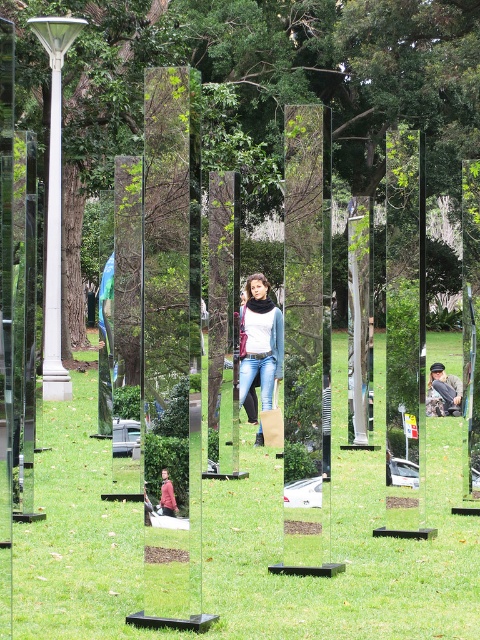
Does matte black scarf at center have a lesser width compared to camouflage fabric jacket at center?

No.

Which is more to the right, matte black scarf at center or camouflage fabric jacket at center?

camouflage fabric jacket at center is more to the right.

What do you see at coordinates (260, 340) in the screenshot? I see `matte black scarf at center` at bounding box center [260, 340].

Where is `matte black scarf at center`? This screenshot has width=480, height=640. matte black scarf at center is located at coordinates (260, 340).

Is green grass at center positioned at the back of red fabric jacket at center?

No, green grass at center is closer to the viewer.

Can you confirm if green grass at center is thinner than red fabric jacket at center?

In fact, green grass at center might be wider than red fabric jacket at center.

Does point (393, 621) lie behind point (168, 496)?

That is True.

The width and height of the screenshot is (480, 640). In order to click on green grass at center in this screenshot , I will do click(343, 548).

Does point (335, 8) come behind point (437, 365)?

Yes, it is.

Can you confirm if green leafy tree at center is smaller than camouflage fabric jacket at center?

No.

Image resolution: width=480 pixels, height=640 pixels. What do you see at coordinates (255, 80) in the screenshot?
I see `green leafy tree at center` at bounding box center [255, 80].

Where is `green leafy tree at center`? Image resolution: width=480 pixels, height=640 pixels. green leafy tree at center is located at coordinates (255, 80).